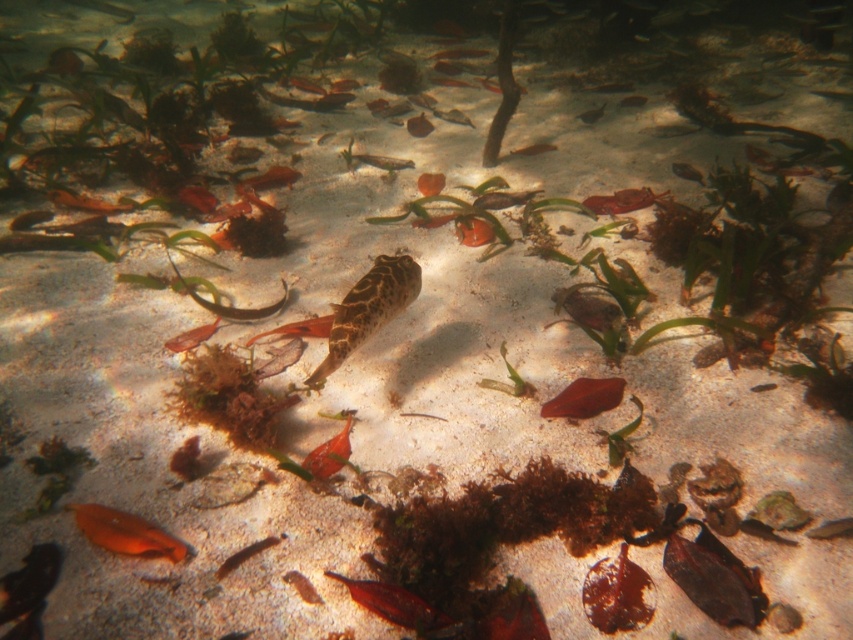
Question: Which object is farther from the camera taking this photo?

Choices:
 (A) translucent orange fish at center
 (B) smooth brown fish at center

Answer: (B)

Question: Considering the relative positions of speckled brown fish at center and smooth brown fish at lower left in the image provided, where is speckled brown fish at center located with respect to smooth brown fish at lower left?

Choices:
 (A) left
 (B) right

Answer: (B)

Question: Which point appears farthest from the camera in this image?

Choices:
 (A) (70, 506)
 (B) (397, 291)

Answer: (B)

Question: Estimate the real-world distances between objects in this image. Which object is closer to the orange matte fish at lower left?

Choices:
 (A) smooth brown leaf at lower center
 (B) smooth brown fish at center
 (C) smooth orange fish at center
 (D) smooth brown fish at lower left

Answer: (D)

Question: Observing the image, what is the correct spatial positioning of smooth brown leaf at lower center in reference to smooth orange fish at center?

Choices:
 (A) below
 (B) above

Answer: (B)

Question: Observing the image, what is the correct spatial positioning of shiny red fish at center in reference to translucent orange fish at center?

Choices:
 (A) above
 (B) below

Answer: (B)